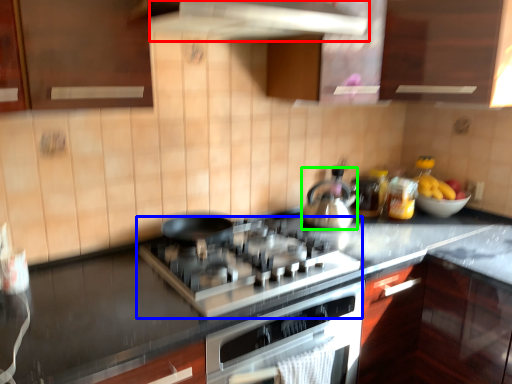
Question: Which object is the farthest from exhaust hood (highlighted by a red box)? Choose among these: gas stove (highlighted by a blue box) or kitchen appliance (highlighted by a green box).

Choices:
 (A) gas stove
 (B) kitchen appliance

Answer: (B)